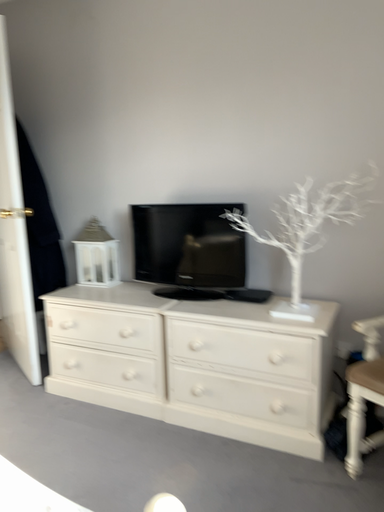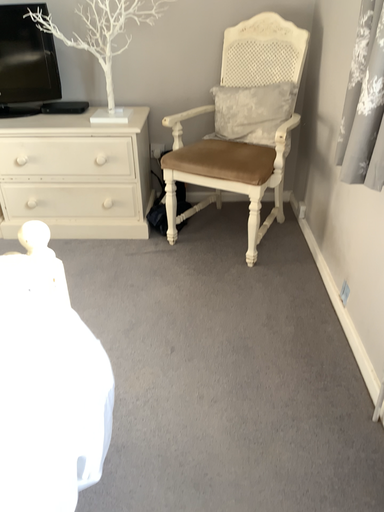
Question: How did the camera likely rotate when shooting the video?

Choices:
 (A) rotated right
 (B) rotated left

Answer: (A)